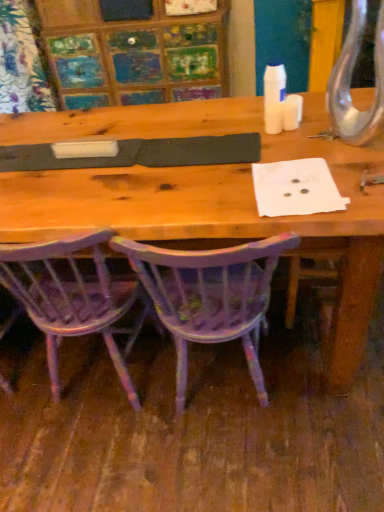
Find the location of a particular element. This screenshot has height=512, width=384. empty space that is ontop of purple painted wood chair at center, which is the 2th chair in left-to-right order (from a real-world perspective) is located at coordinates 202,197.